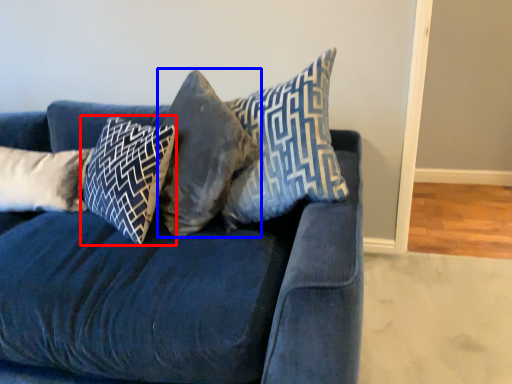
Question: Which point is closer to the camera, pillow (highlighted by a red box) or pillow (highlighted by a blue box)?

Choices:
 (A) pillow
 (B) pillow

Answer: (B)